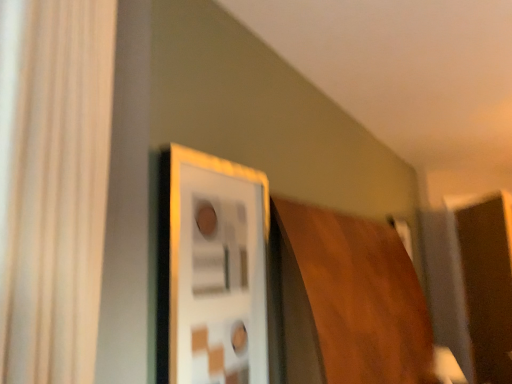
Where is `wooden frame at upper center`? wooden frame at upper center is located at coordinates (211, 270).

Image resolution: width=512 pixels, height=384 pixels. What do you see at coordinates (211, 270) in the screenshot?
I see `wooden frame at upper center` at bounding box center [211, 270].

At what (x,y) coordinates should I click in order to perform the action: click on wooden frame at upper center. Please return your answer as a coordinate pair (x, y). The image size is (512, 384). Looking at the image, I should click on tap(211, 270).